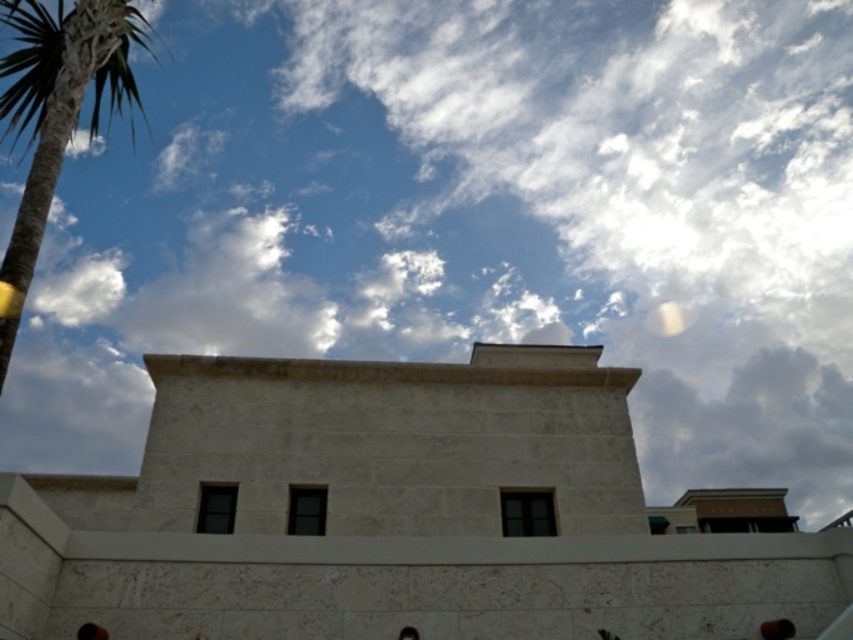
Is black matte person at lower right below black matte person at lower left?

Correct, black matte person at lower right is located below black matte person at lower left.

Is black matte person at lower right to the left of black matte person at lower left from the viewer's perspective?

Incorrect, black matte person at lower right is not on the left side of black matte person at lower left.

I want to click on black matte person at lower right, so click(776, 628).

Find the location of a particular element. Image resolution: width=853 pixels, height=640 pixels. black matte person at lower right is located at coordinates (776, 628).

Does black matte person at lower left have a larger size compared to black matte person at lower center?

Correct, black matte person at lower left is larger in size than black matte person at lower center.

Which of these two, black matte person at lower left or black matte person at lower center, stands taller?

With more height is black matte person at lower left.

Is point (78, 634) in front of point (418, 634)?

Yes, it is.

This screenshot has width=853, height=640. I want to click on black matte person at lower left, so click(91, 632).

Does point (25, 29) come farther from viewer compared to point (90, 632)?

Yes, point (25, 29) is farther from viewer.

Looking at this image, does green leafy palm at upper left appear on the left side of black matte person at lower left?

Yes, green leafy palm at upper left is to the left of black matte person at lower left.

Which is in front, point (57, 115) or point (79, 636)?

Point (79, 636)

The image size is (853, 640). I want to click on green leafy palm at upper left, so click(x=56, y=112).